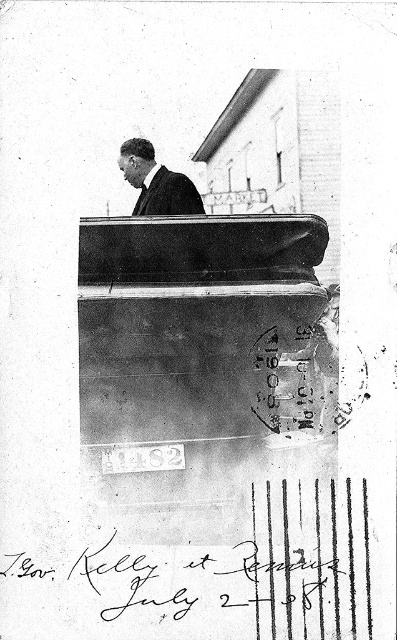
Question: Does dark suit at center appear on the left side of black silk tie at upper center?

Choices:
 (A) yes
 (B) no

Answer: (B)

Question: Is dark suit at center above black silk tie at upper center?

Choices:
 (A) no
 (B) yes

Answer: (B)

Question: Which point is farther from the camera taking this photo?

Choices:
 (A) (181, 208)
 (B) (136, 205)

Answer: (A)

Question: Does dark suit at center appear on the left side of black silk tie at upper center?

Choices:
 (A) no
 (B) yes

Answer: (A)